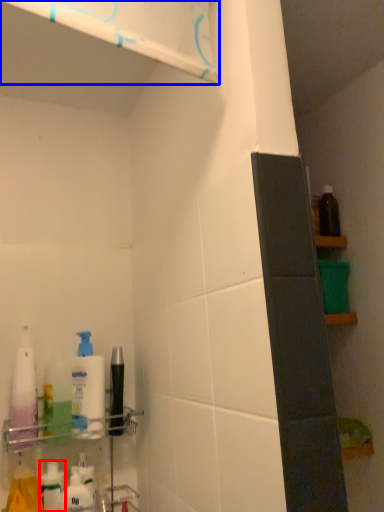
Question: Which point is closer to the camera, toiletry (highlighted by a red box) or shelf (highlighted by a blue box)?

Choices:
 (A) toiletry
 (B) shelf

Answer: (B)